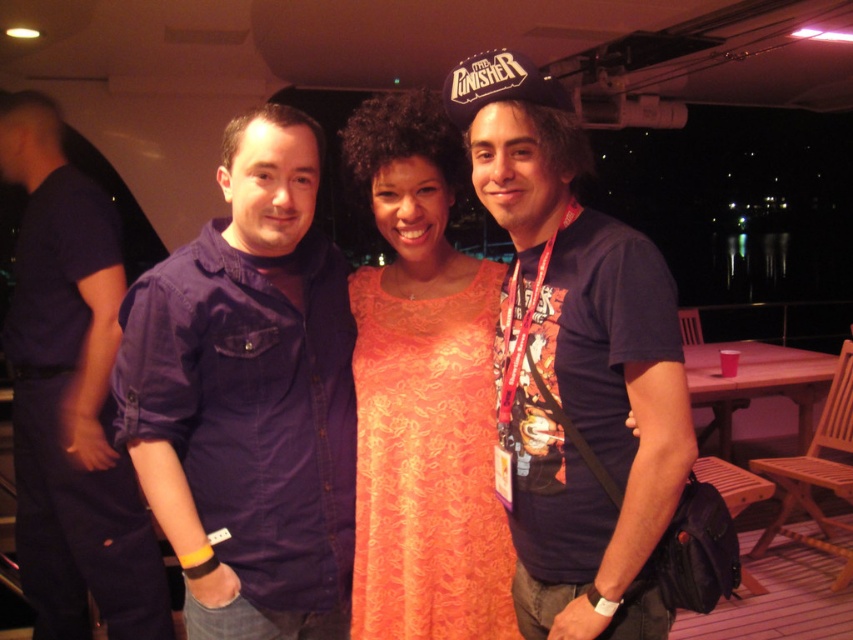
Which is more to the right, orange lace dress at center or denim shirt at left?

orange lace dress at center is more to the right.

Which is more to the left, orange lace dress at center or denim shirt at left?

denim shirt at left is more to the left.

Describe the element at coordinates (422, 394) in the screenshot. This screenshot has width=853, height=640. I see `orange lace dress at center` at that location.

At what (x,y) coordinates should I click in order to perform the action: click on orange lace dress at center. Please return your answer as a coordinate pair (x, y). Looking at the image, I should click on (422, 394).

Who is taller, red lanyard at center or orange lace dress at center?

Standing taller between the two is orange lace dress at center.

Does red lanyard at center have a lesser height compared to orange lace dress at center?

Indeed, red lanyard at center has a lesser height compared to orange lace dress at center.

Does point (631, 266) lie in front of point (402, 156)?

Yes, it is in front of point (402, 156).

The image size is (853, 640). What are the coordinates of `red lanyard at center` in the screenshot? It's located at (575, 364).

Does point (613, 349) lie in front of point (61, 538)?

Yes.

What do you see at coordinates (575, 364) in the screenshot?
I see `red lanyard at center` at bounding box center [575, 364].

This screenshot has width=853, height=640. What are the coordinates of `red lanyard at center` in the screenshot? It's located at (575, 364).